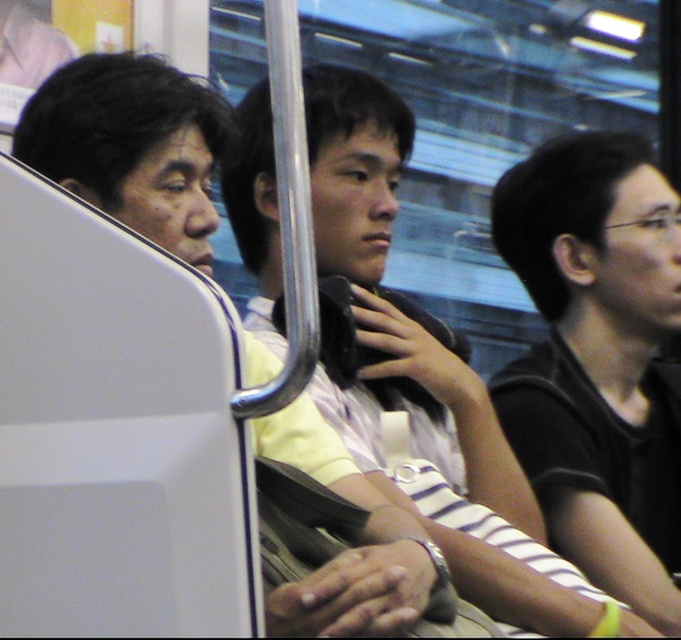
You are a passenger on a train and need to place a small item on the seat between the black matte shirt at right and the matte black bag at center. Which side should you choose to ensure the item doesn

The black matte shirt at right has a greater height compared to the matte black bag at center. Therefore, placing the item closer to the matte black bag at center would provide a flatter surface.

You are a designer creating a layout for a magazine spread. You need to place the black matte shirt at right and the matte black headphones at center in a way that maintains their relative size as shown in the image. Which object should you make smaller in your design?

The black matte shirt at right has a lesser width compared to the matte black headphones at center, so in the design, the black matte shirt at right should be made smaller to maintain the correct size relationship.

You are standing at the back of the train and want to reach the front. You see two points marked on the seats, point (550, 193) and point (274, 349). Which point should you step on first to move forward?

You should step on point (550, 193) first because it is closer to you than point (274, 349), which is further away.